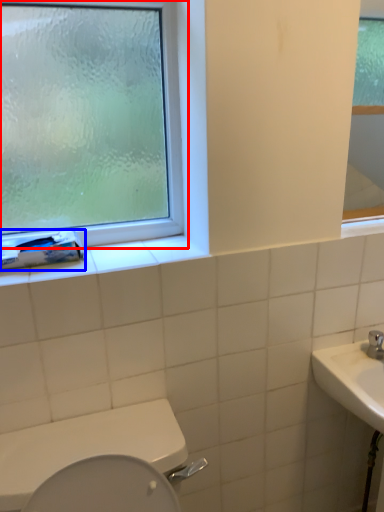
Question: Which of the following is the farthest to the observer, window (highlighted by a red box) or toilet paper (highlighted by a blue box)?

Choices:
 (A) window
 (B) toilet paper

Answer: (B)